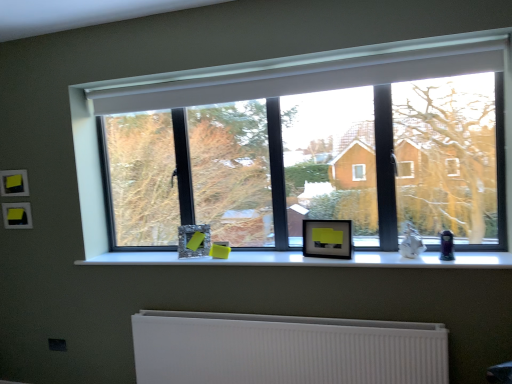
Question: Can you confirm if white matte window sill at center is positioned to the right of white ribbed radiator at lower center?

Choices:
 (A) no
 (B) yes

Answer: (B)

Question: From a real-world perspective, is white matte window sill at center positioned under white ribbed radiator at lower center based on gravity?

Choices:
 (A) no
 (B) yes

Answer: (A)

Question: Are white matte window sill at center and white ribbed radiator at lower center far apart?

Choices:
 (A) no
 (B) yes

Answer: (A)

Question: From a real-world perspective, does white matte window sill at center stand above white ribbed radiator at lower center?

Choices:
 (A) yes
 (B) no

Answer: (A)

Question: Can you confirm if white matte window sill at center is shorter than white ribbed radiator at lower center?

Choices:
 (A) yes
 (B) no

Answer: (A)

Question: Could you tell me if white matte window sill at center is facing white ribbed radiator at lower center?

Choices:
 (A) yes
 (B) no

Answer: (B)

Question: From a real-world perspective, is black matte picture frame at center, which is the 1th picture frame in front-to-back order, on top of white ribbed radiator at lower center?

Choices:
 (A) no
 (B) yes

Answer: (B)

Question: Is black matte picture frame at center, which is the 2th picture frame in back-to-front order, shorter than white ribbed radiator at lower center?

Choices:
 (A) yes
 (B) no

Answer: (A)

Question: Is black matte picture frame at center, which is the 1th picture frame in front-to-back order, facing towards white ribbed radiator at lower center?

Choices:
 (A) no
 (B) yes

Answer: (A)

Question: From a real-world perspective, is black matte picture frame at center, which is the 2th picture frame in back-to-front order, below white ribbed radiator at lower center?

Choices:
 (A) yes
 (B) no

Answer: (B)

Question: Can you confirm if black matte picture frame at center, which is counted as the 1th picture frame, starting from the right, is positioned to the right of white ribbed radiator at lower center?

Choices:
 (A) yes
 (B) no

Answer: (A)

Question: Is black matte picture frame at center, which is the 1th picture frame in front-to-back order, taller than white ribbed radiator at lower center?

Choices:
 (A) no
 (B) yes

Answer: (A)

Question: Does white ribbed radiator at lower center appear on the left side of matte glass picture frame at center, the 1th picture frame from the back?

Choices:
 (A) no
 (B) yes

Answer: (A)